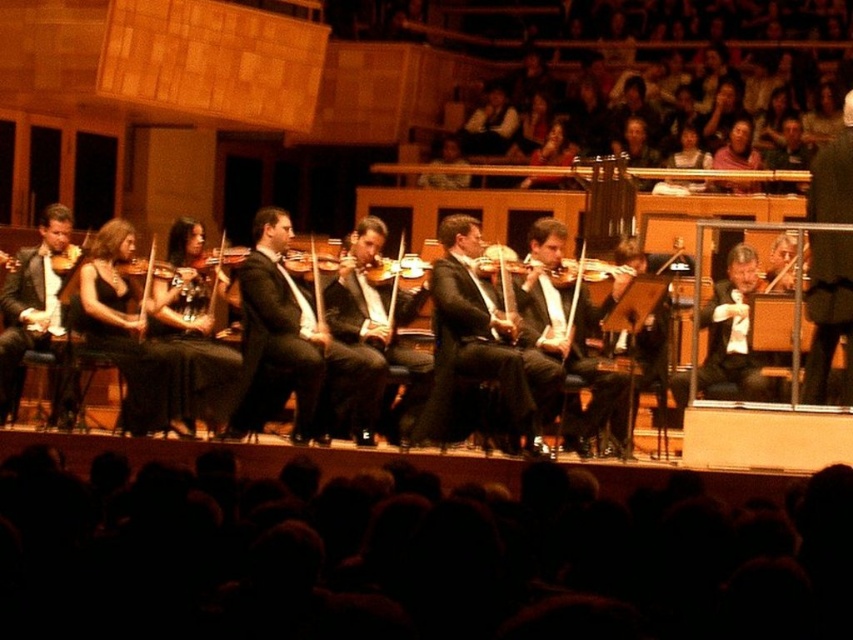
Does matte black violin at left have a smaller size compared to matte black violin at center?

Indeed, matte black violin at left has a smaller size compared to matte black violin at center.

Image resolution: width=853 pixels, height=640 pixels. In order to click on matte black violin at left in this screenshot , I will do `click(32, 304)`.

At what (x,y) coordinates should I click in order to perform the action: click on matte black violin at left. Please return your answer as a coordinate pair (x, y). The width and height of the screenshot is (853, 640). Looking at the image, I should click on (32, 304).

Who is positioned more to the left, matte black violin at center or wooden violin at center?

matte black violin at center

Can you confirm if matte black violin at center is taller than wooden violin at center?

Yes.

Who is more forward, (389, 342) or (483, 252)?

Point (389, 342) is more forward.

Find the location of a particular element. The image size is (853, 640). matte black violin at center is located at coordinates (380, 304).

Measure the distance between black satin violin at center and camera.

The distance of black satin violin at center from camera is 25.77 meters.

Who is lower down, black satin violin at center or matte black violin at left?

matte black violin at left is below.

Which is behind, point (474, 257) or point (16, 381)?

The point (474, 257) is more distant.

I want to click on black satin violin at center, so click(476, 342).